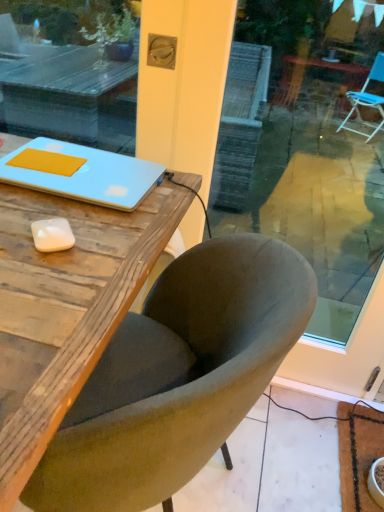
Question: Can you confirm if velvet green chair at center is wider than matte blue laptop at upper left?

Choices:
 (A) yes
 (B) no

Answer: (A)

Question: Is velvet green chair at center at the right side of matte blue laptop at upper left?

Choices:
 (A) yes
 (B) no

Answer: (A)

Question: Is velvet green chair at center looking in the opposite direction of matte blue laptop at upper left?

Choices:
 (A) yes
 (B) no

Answer: (B)

Question: From the image's perspective, would you say velvet green chair at center is positioned over matte blue laptop at upper left?

Choices:
 (A) yes
 (B) no

Answer: (B)

Question: From the image's perspective, would you say velvet green chair at center is shown under matte blue laptop at upper left?

Choices:
 (A) no
 (B) yes

Answer: (B)

Question: Considering the relative sizes of velvet green chair at center and matte blue laptop at upper left in the image provided, is velvet green chair at center thinner than matte blue laptop at upper left?

Choices:
 (A) no
 (B) yes

Answer: (A)

Question: Could you tell me if matte blue laptop at upper left is facing velvet green chair at center?

Choices:
 (A) no
 (B) yes

Answer: (B)

Question: Is matte blue laptop at upper left touching velvet green chair at center?

Choices:
 (A) yes
 (B) no

Answer: (B)

Question: Is matte blue laptop at upper left to the left of velvet green chair at center from the viewer's perspective?

Choices:
 (A) no
 (B) yes

Answer: (B)

Question: Is the depth of matte blue laptop at upper left less than that of velvet green chair at center?

Choices:
 (A) yes
 (B) no

Answer: (B)

Question: Does matte blue laptop at upper left have a larger size compared to velvet green chair at center?

Choices:
 (A) yes
 (B) no

Answer: (B)

Question: Considering the relative sizes of matte blue laptop at upper left and velvet green chair at center in the image provided, is matte blue laptop at upper left thinner than velvet green chair at center?

Choices:
 (A) yes
 (B) no

Answer: (A)

Question: Is point (304, 301) closer or farther from the camera than point (1, 176)?

Choices:
 (A) closer
 (B) farther

Answer: (A)